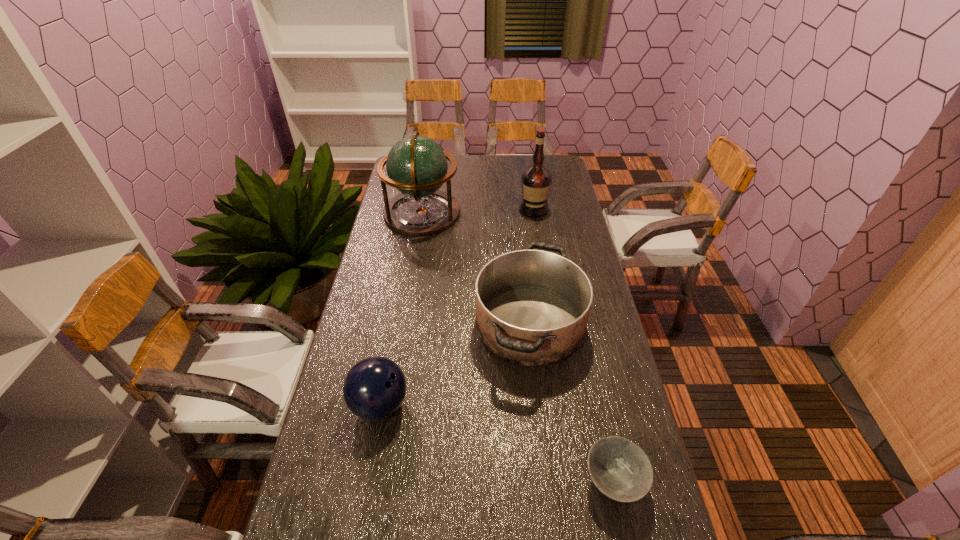
Locate an element on the screen. The image size is (960, 540). free spot between the saucepan and the bowling ball is located at coordinates (455, 364).

Where is `free spot between the bowling ball and the saucepan`? The image size is (960, 540). free spot between the bowling ball and the saucepan is located at coordinates (455, 364).

At what (x,y) coordinates should I click in order to perform the action: click on vacant space in between the nearest object and the bowling ball. Please return your answer as a coordinate pair (x, y). The image size is (960, 540). Looking at the image, I should click on (496, 443).

At what (x,y) coordinates should I click in order to perform the action: click on free space between the globe and the liquor. Please return your answer as a coordinate pair (x, y). The height and width of the screenshot is (540, 960). Looking at the image, I should click on (478, 211).

What are the coordinates of `object that can be found as the closest to the bowling ball` in the screenshot? It's located at (532, 306).

The image size is (960, 540). In order to click on object that is the closest one to the bowl in this screenshot , I will do `click(532, 306)`.

Locate an element on the screen. The image size is (960, 540). vacant point that satisfies the following two spatial constraints: 1. on the front-facing side of the saucepan; 2. on the left side of the globe is located at coordinates (403, 323).

Where is `vacant area that satisfies the following two spatial constraints: 1. on the front side of the saucepan; 2. on the surface of the bowling ball near the finger holes`? This screenshot has width=960, height=540. vacant area that satisfies the following two spatial constraints: 1. on the front side of the saucepan; 2. on the surface of the bowling ball near the finger holes is located at coordinates (539, 404).

I want to click on vacant area that satisfies the following two spatial constraints: 1. on the front-facing side of the globe; 2. on the right side of the shortest object, so tap(377, 481).

What are the coordinates of `vacant area in the image that satisfies the following two spatial constraints: 1. on the front-facing side of the globe; 2. on the back side of the shortest object` in the screenshot? It's located at (377, 481).